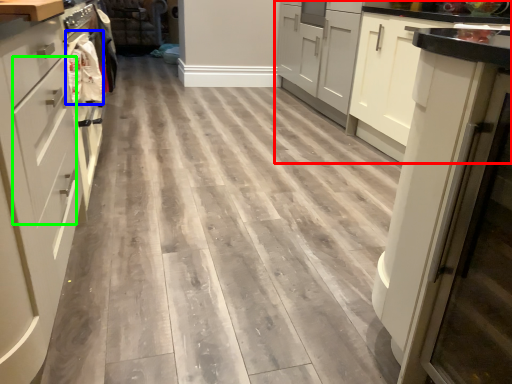
Question: Which is nearer to the cabinetry (highlighted by a red box)? material (highlighted by a blue box) or drawer (highlighted by a green box).

Choices:
 (A) material
 (B) drawer

Answer: (A)